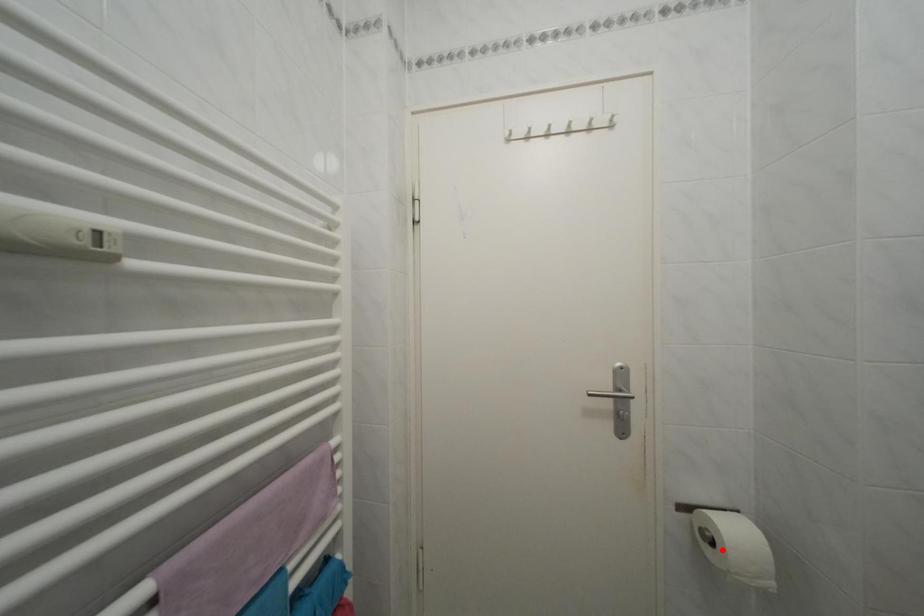
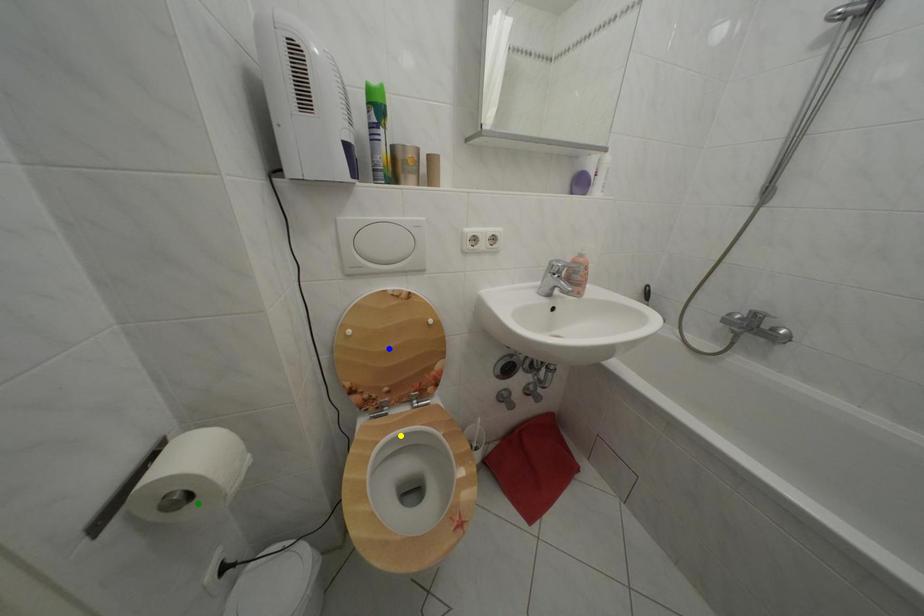
Question: I am providing you with two images of the same scene from different viewpoints. A red point is marked on the first image. You are given multiple points on the second image. In image 2, which mark is for the same physical point as the one in image 1?

Choices:
 (A) green point
 (B) yellow point
 (C) blue point

Answer: (A)